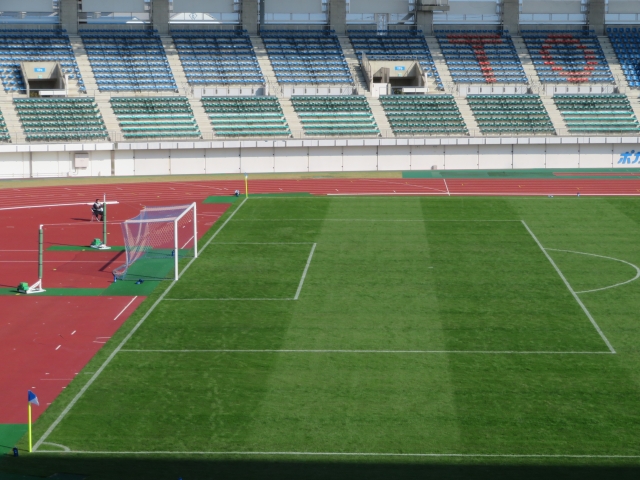
Identify the location of wall. (395, 158).